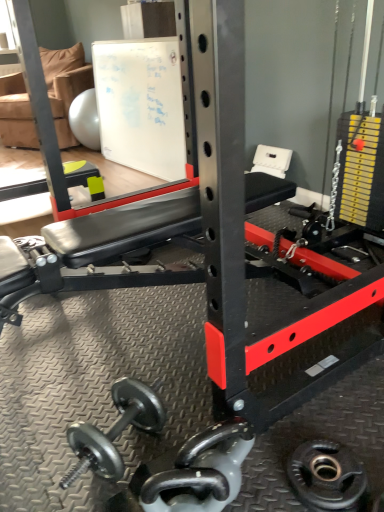
Question: In the image, is tan fabric chair at upper left positioned in front of or behind black rubber weight plate at lower right?

Choices:
 (A) front
 (B) behind

Answer: (B)

Question: Is tan fabric chair at upper left inside the boundaries of black rubber weight plate at lower right, or outside?

Choices:
 (A) inside
 (B) outside

Answer: (B)

Question: Which object is the farthest from the polished silver dumbbell at center?

Choices:
 (A) tan fabric chair at upper left
 (B) white matte board at upper center
 (C) black rubber weight plate at lower right

Answer: (A)

Question: Estimate the real-world distances between objects in this image. Which object is farther from the black rubber weight plate at lower right?

Choices:
 (A) tan fabric chair at upper left
 (B) white matte board at upper center
 (C) polished silver dumbbell at center

Answer: (A)